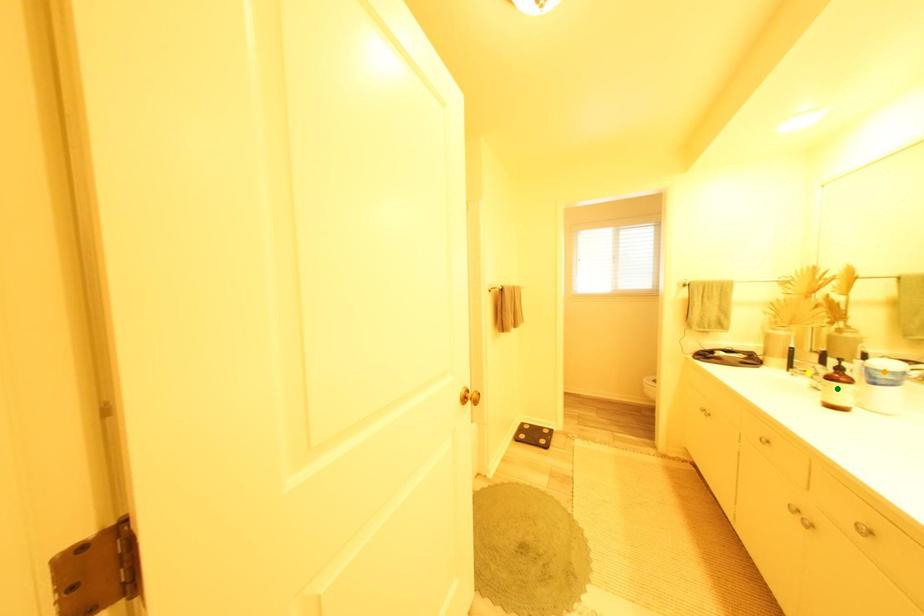
Order these from nearest to farthest:
1. green point
2. yellow point
3. orange point

1. orange point
2. green point
3. yellow point